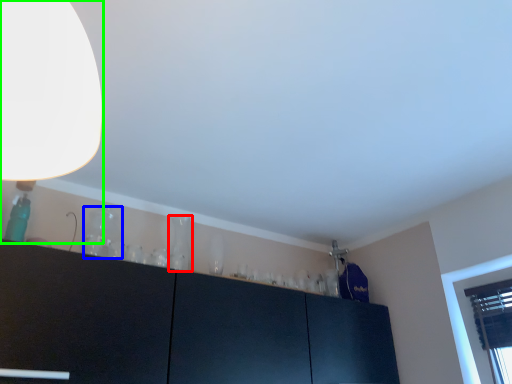
Question: Which is nearer to the glass vase (highlighted by a red box)? glass vase (highlighted by a blue box) or lamp (highlighted by a green box).

Choices:
 (A) glass vase
 (B) lamp

Answer: (A)